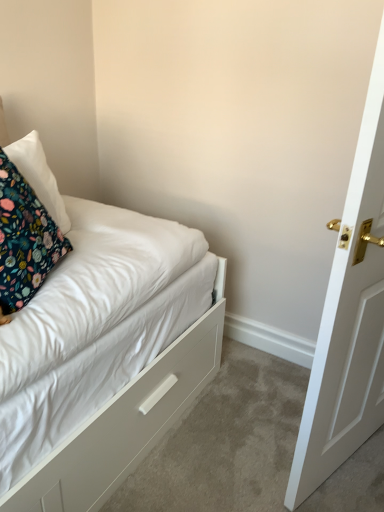
Question: Considering the positions of floral fabric pillow at upper left, the 2th pillow positioned from the front, and floral fabric pillow at left, the first pillow viewed from the front, in the image, is floral fabric pillow at upper left, the 2th pillow positioned from the front, taller or shorter than floral fabric pillow at left, the first pillow viewed from the front,?

Choices:
 (A) tall
 (B) short

Answer: (B)

Question: Considering the positions of point (56, 220) and point (13, 308), is point (56, 220) closer or farther from the camera than point (13, 308)?

Choices:
 (A) closer
 (B) farther

Answer: (B)

Question: Considering the real-world distances, which object is farthest from the white matte drawer at lower left?

Choices:
 (A) floral fabric pillow at upper left, the first pillow from the back
 (B) floral fabric pillow at left, the first pillow viewed from the front

Answer: (A)

Question: Estimate the real-world distances between objects in this image. Which object is farther from the floral fabric pillow at left, the first pillow viewed from the front?

Choices:
 (A) floral fabric pillow at upper left, the first pillow from the back
 (B) white matte drawer at lower left

Answer: (B)